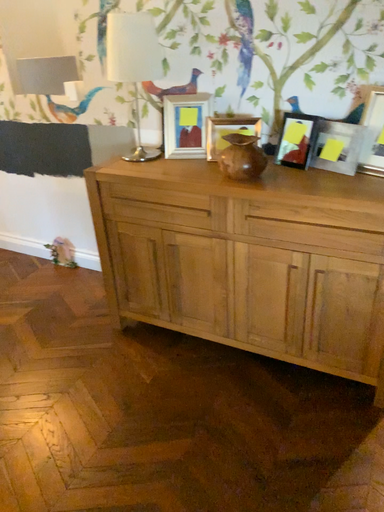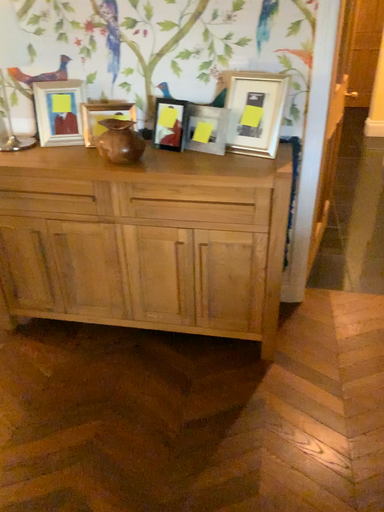
Question: Which way did the camera rotate in the video?

Choices:
 (A) rotated right
 (B) rotated left

Answer: (A)